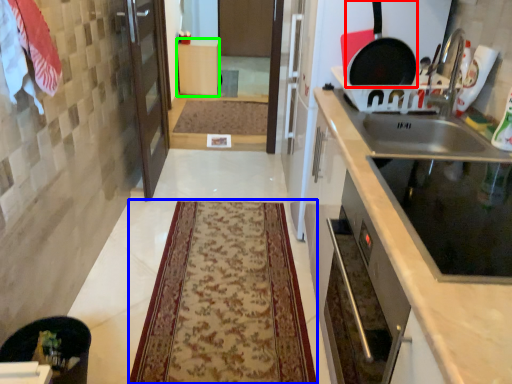
Question: Which is farther away from frying pan (highlighted by a red box)? mat (highlighted by a blue box) or cabinetry (highlighted by a green box)?

Choices:
 (A) mat
 (B) cabinetry

Answer: (B)